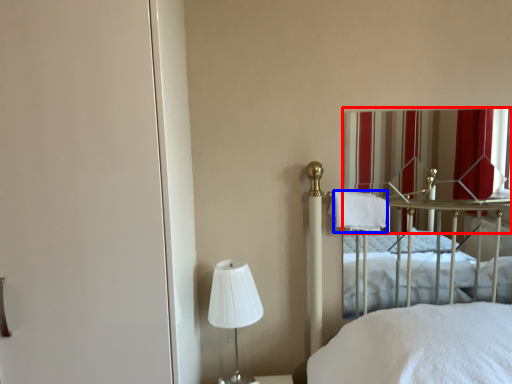
Question: Which of the following is the closest to the observer, curtain (highlighted by a red box) or cloth (highlighted by a blue box)?

Choices:
 (A) curtain
 (B) cloth

Answer: (B)